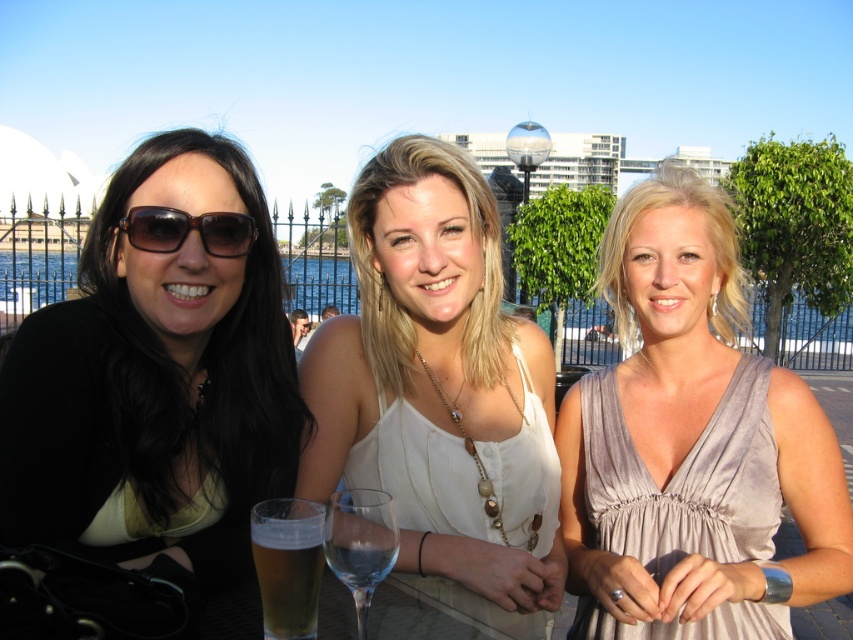
You are a photographer setting up a shot of the three women. You want to ensure both the golden translucent glass at lower left and the clear glass wine at center are in focus. Which glass should you focus on first to ensure both are sharp?

You should focus on the golden translucent glass at lower left first because it is closer to you than the clear glass wine at center.

You are a photographer trying to capture the middle woman and the items in front of her. Which item is positioned to the right of the other between the white satin blouse at center and the transparent glass wine glass at center?

The white satin blouse at center is positioned to the right of the transparent glass wine glass at center.

You are a photographer setting up a shot of the two women in the scene. You need to ensure that the white satin blouse at center and the transparent glass wine glass at center are both in focus. Given their height difference, which object should you adjust your camera focus on first to ensure both are sharp?

The white satin blouse at center is taller than the transparent glass wine glass at center, so you should focus on the white satin blouse at center first to ensure both are in focus.